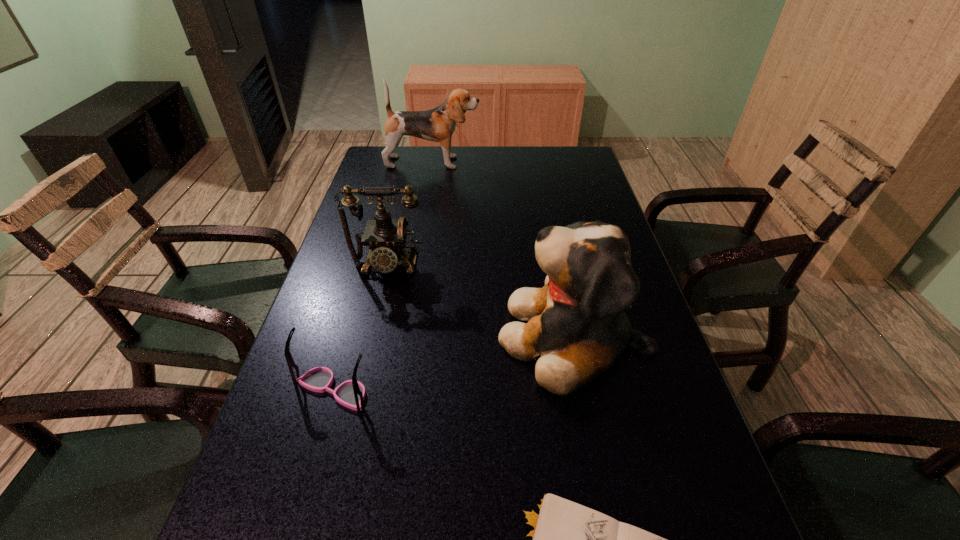
Find the location of a particular element. This screenshot has height=540, width=960. vacant space at the right edge of the desktop is located at coordinates (624, 387).

This screenshot has height=540, width=960. I want to click on empty space that is in between the right puppy and the spectacles, so click(454, 363).

At what (x,y) coordinates should I click in order to perform the action: click on empty space between the spectacles and the right puppy. Please return your answer as a coordinate pair (x, y). This screenshot has height=540, width=960. Looking at the image, I should click on (454, 363).

Where is `free spot between the nearer puppy and the left puppy`? free spot between the nearer puppy and the left puppy is located at coordinates (503, 250).

Find the location of `free point between the farther puppy and the nearer puppy`. free point between the farther puppy and the nearer puppy is located at coordinates (503, 250).

I want to click on the closest object to the spectacles, so click(x=577, y=329).

The image size is (960, 540). I want to click on the fourth closest object relative to the right puppy, so click(x=438, y=124).

Find the location of `blank space that satisfies the following two spatial constraints: 1. at the face of the farther puppy; 2. on the rotary dial of the second farthest object`. blank space that satisfies the following two spatial constraints: 1. at the face of the farther puppy; 2. on the rotary dial of the second farthest object is located at coordinates (415, 265).

What are the coordinates of `free location that satisfies the following two spatial constraints: 1. at the face of the farther puppy; 2. on the rotary dial of the fourth nearest object` in the screenshot? It's located at (415, 265).